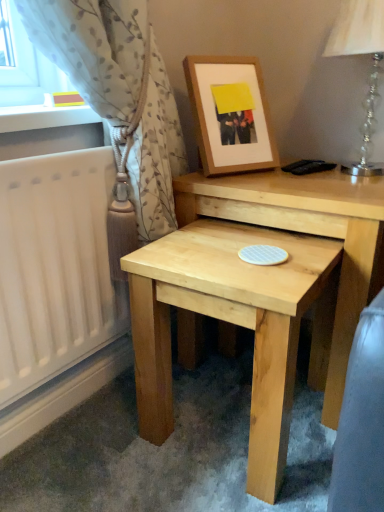
Question: Looking at their shapes, would you say natural wood table at center, the first table from the back, is wider or thinner than light beige textured curtain at left?

Choices:
 (A) thin
 (B) wide

Answer: (B)

Question: Does point (190, 173) appear closer or farther from the camera than point (69, 70)?

Choices:
 (A) farther
 (B) closer

Answer: (A)

Question: Estimate the real-world distances between objects in this image. Which object is closer to the natural wood table at center, the first table from the back?

Choices:
 (A) wooden frame at upper center
 (B) natural wood table at lower center, the first table in the front-to-back sequence
 (C) clear crystal glass table lamp at upper right
 (D) light beige textured curtain at left

Answer: (B)

Question: Estimate the real-world distances between objects in this image. Which object is farther from the light beige textured curtain at left?

Choices:
 (A) natural wood table at center, the first table from the back
 (B) natural wood table at lower center, placed as the 2th table when sorted from back to front
 (C) wooden frame at upper center
 (D) clear crystal glass table lamp at upper right

Answer: (D)